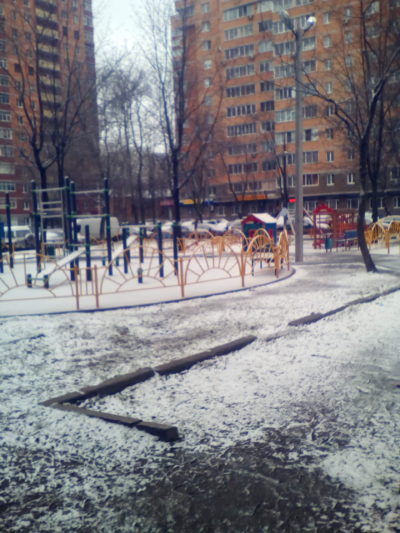
I want to click on windows, so click(244, 71), click(309, 183), click(327, 64), click(5, 114), click(14, 33).